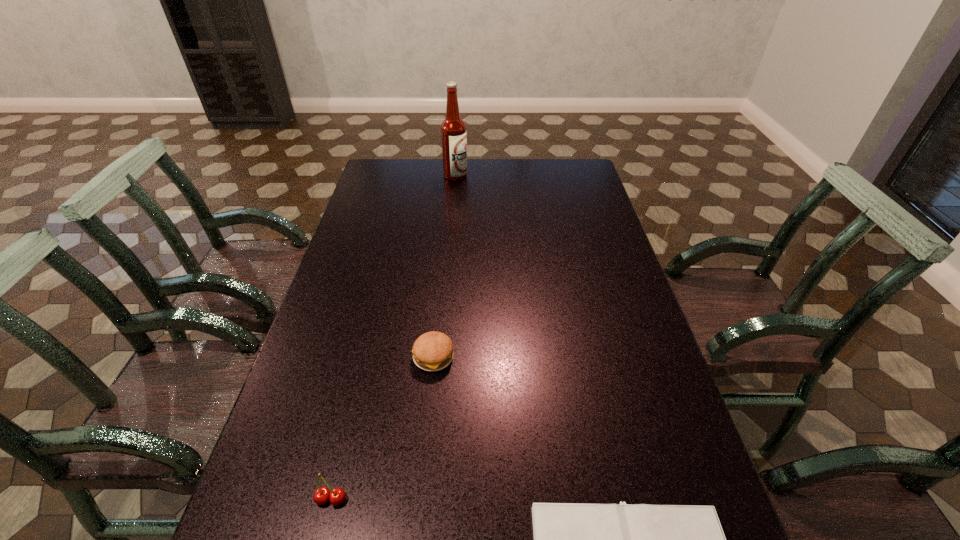
Locate an element on the screen. object that is the nearest to the hardback book is located at coordinates (433, 351).

At what (x,y) coordinates should I click in order to perform the action: click on vacant space that satisfies the following two spatial constraints: 1. on the label side of the alcohol; 2. on the front side of the third nearest object. Please return your answer as a coordinate pair (x, y). The image size is (960, 540). Looking at the image, I should click on (441, 357).